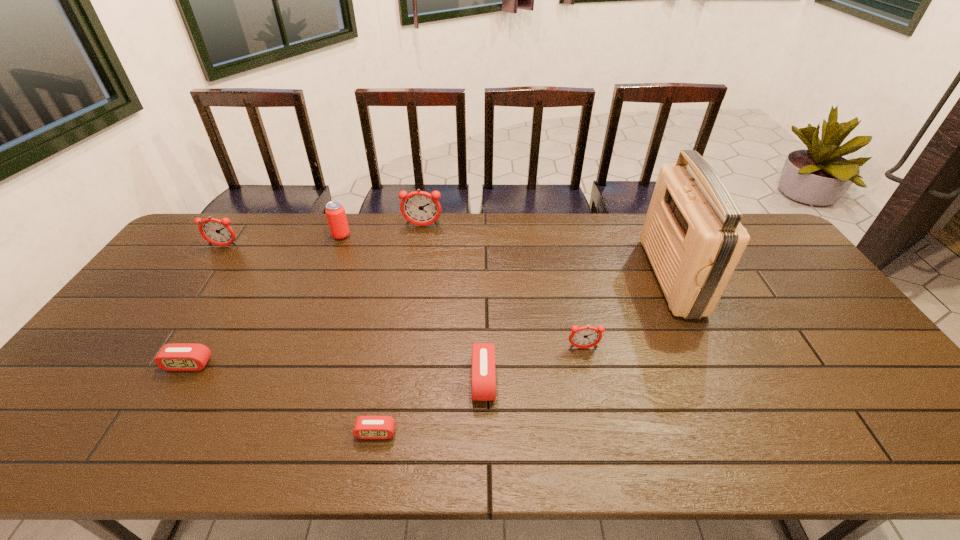
The height and width of the screenshot is (540, 960). Find the location of `object that is at the left edge`. object that is at the left edge is located at coordinates (218, 232).

Where is `object present at the far left corner`? The height and width of the screenshot is (540, 960). object present at the far left corner is located at coordinates (218, 232).

You are a GUI agent. You are given a task and a screenshot of the screen. Output one action in this format:
    pyautogui.click(x=<x>, y=<y>)
    Task: Click on the free spot at the far edge of the desktop
    The width and height of the screenshot is (960, 540).
    Given the screenshot: What is the action you would take?
    pyautogui.click(x=324, y=214)

This screenshot has width=960, height=540. In the image, there is a desktop. What are the coordinates of `vacant space at the near edge` in the screenshot? It's located at (447, 438).

The image size is (960, 540). In the image, there is a desktop. What are the coordinates of `vacant space at the left edge` in the screenshot? It's located at (197, 269).

The image size is (960, 540). Identify the location of vacant space at the right edge of the desktop. (785, 325).

I want to click on vacant region at the near left corner, so click(x=10, y=454).

Locate an element on the screen. vacant area at the far right corner is located at coordinates (744, 227).

Identify the location of vacant point located between the smallest pink alarm clock and the leftmost reddish-pink alarm clock. This screenshot has width=960, height=540. (300, 340).

Where is `free space between the tallest object and the red beer can`? The width and height of the screenshot is (960, 540). free space between the tallest object and the red beer can is located at coordinates (506, 256).